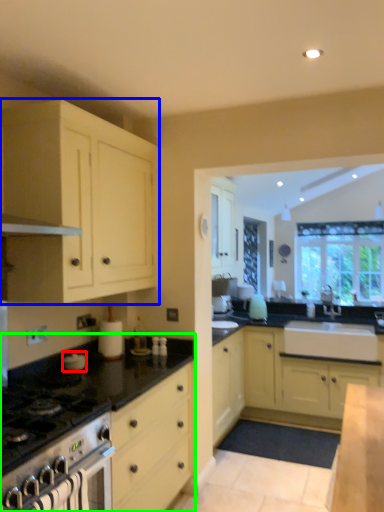
Question: Estimate the real-world distances between objects in this image. Which object is closer to appliance (highlighted by a red box), cabinetry (highlighted by a blue box) or countertop (highlighted by a green box)?

Choices:
 (A) cabinetry
 (B) countertop

Answer: (B)